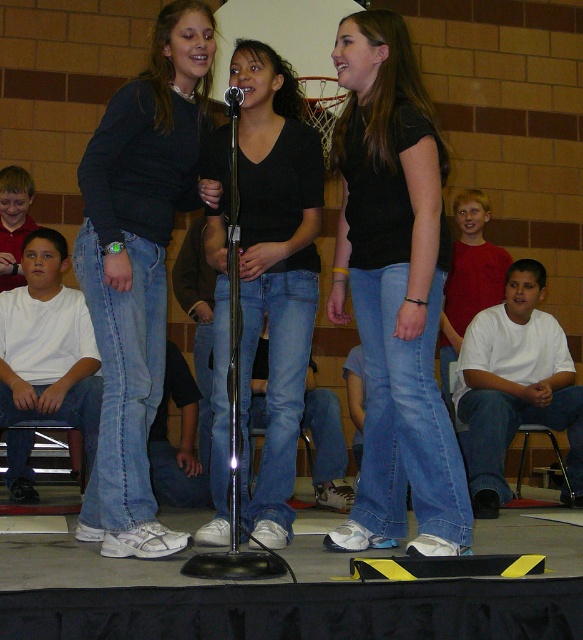
Who is more distant from viewer, (245,509) or (2,198)?

Point (2,198)

Can you confirm if black matte jeans at center is positioned to the left of matte red shirt at left?

No, black matte jeans at center is not to the left of matte red shirt at left.

This screenshot has height=640, width=583. In order to click on black matte jeans at center in this screenshot , I will do click(x=275, y=269).

You are a GUI agent. You are given a task and a screenshot of the screen. Output one action in this format:
    pyautogui.click(x=<x>, y=<y>)
    Task: Click on the black matte jeans at center
    This screenshot has height=640, width=583.
    Given the screenshot: What is the action you would take?
    pyautogui.click(x=275, y=269)

Can you confirm if red matte shirt at lower right is taller than matte red shirt at left?

Indeed, red matte shirt at lower right has a greater height compared to matte red shirt at left.

Between point (483, 305) and point (22, 282), which one is positioned in front?

Positioned in front is point (22, 282).

Locate an element on the screen. Image resolution: width=583 pixels, height=640 pixels. red matte shirt at lower right is located at coordinates (468, 276).

Is black matte jeans at center thinner than red matte shirt at lower right?

Correct, black matte jeans at center's width is less than red matte shirt at lower right's.

Does black matte jeans at center appear on the left side of red matte shirt at lower right?

Indeed, black matte jeans at center is positioned on the left side of red matte shirt at lower right.

Who is more distant from viewer, (289, 444) or (458, 298)?

Point (458, 298)

Where is `black matte jeans at center`? black matte jeans at center is located at coordinates (275, 269).